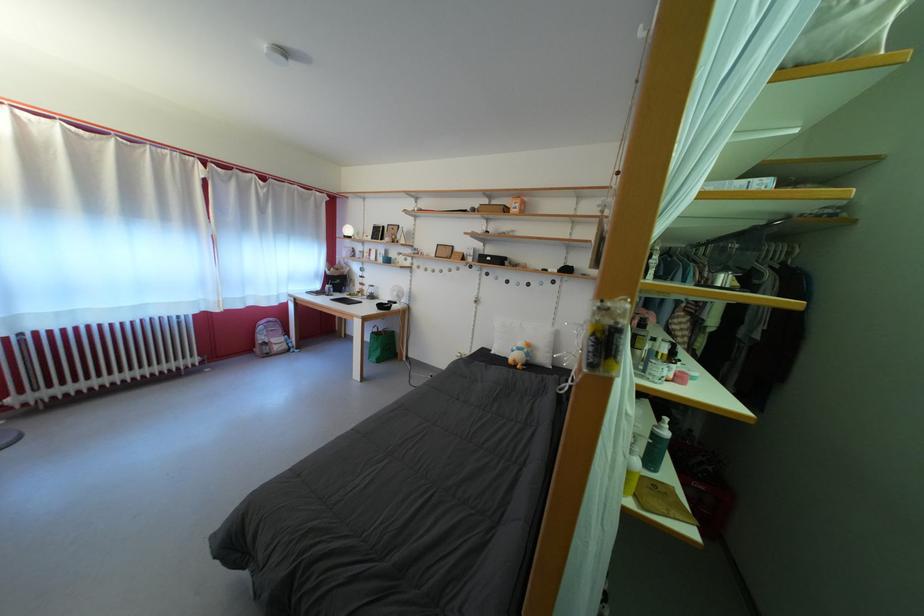
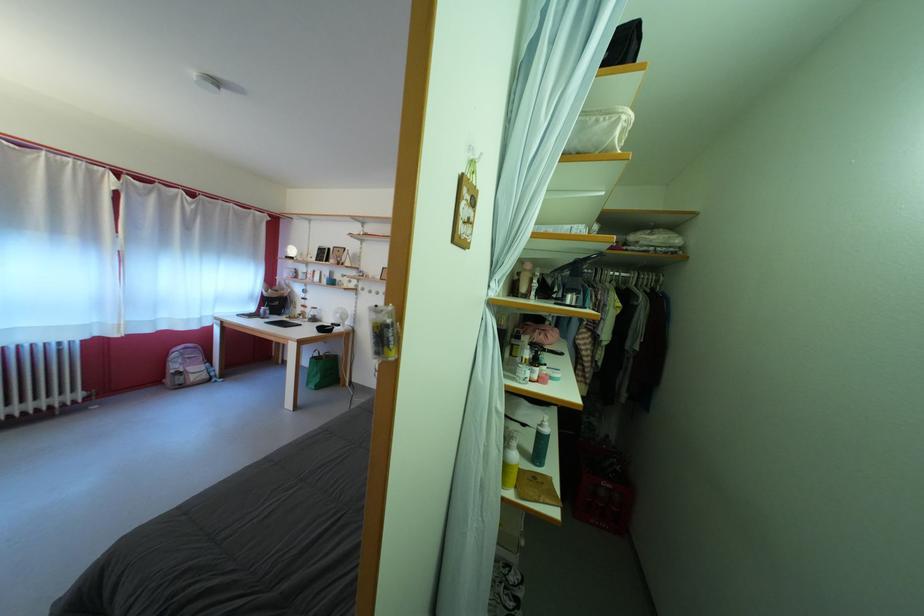
In the second image, find the point that corresponds to point (679, 382) in the first image.

(543, 383)